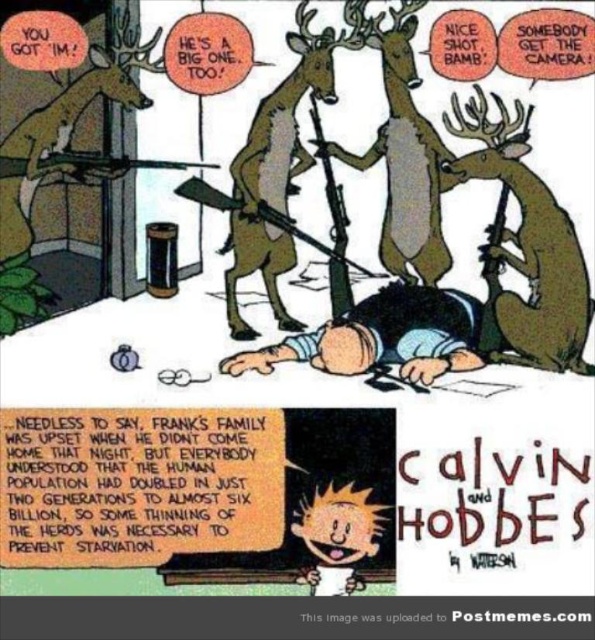
Based on the scene description, can the black matte person at lower center fit through the brown matte door at upper left? Please explain using their widths.

The black matte person at lower center is wider than the brown matte door at upper left, so they cannot fit through the door.